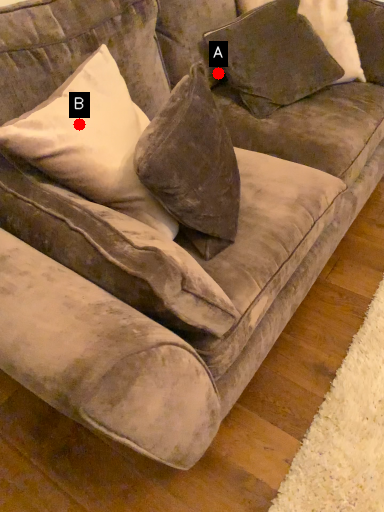
Question: Two points are circled on the image, labeled by A and B beside each circle. Which point is closer to the camera?

Choices:
 (A) A is closer
 (B) B is closer

Answer: (B)